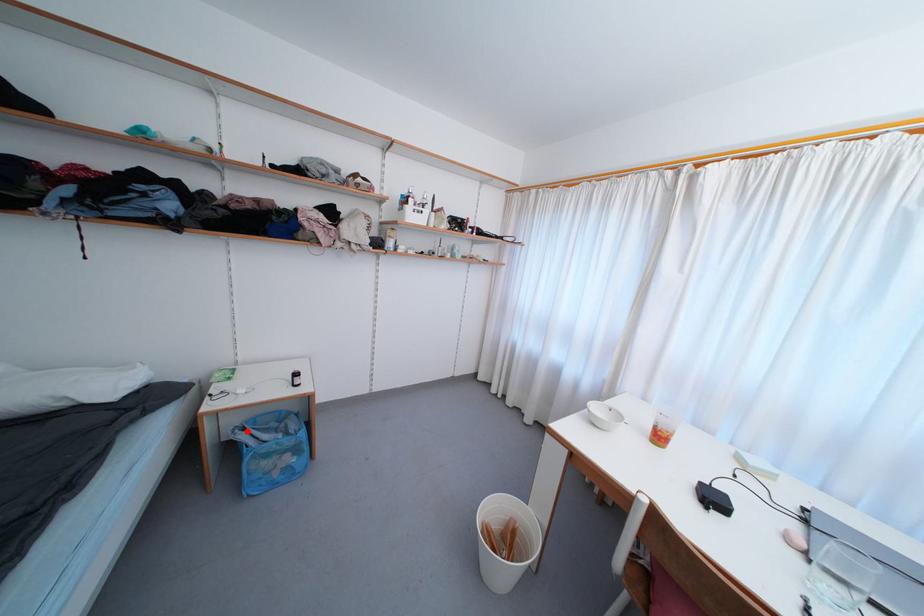
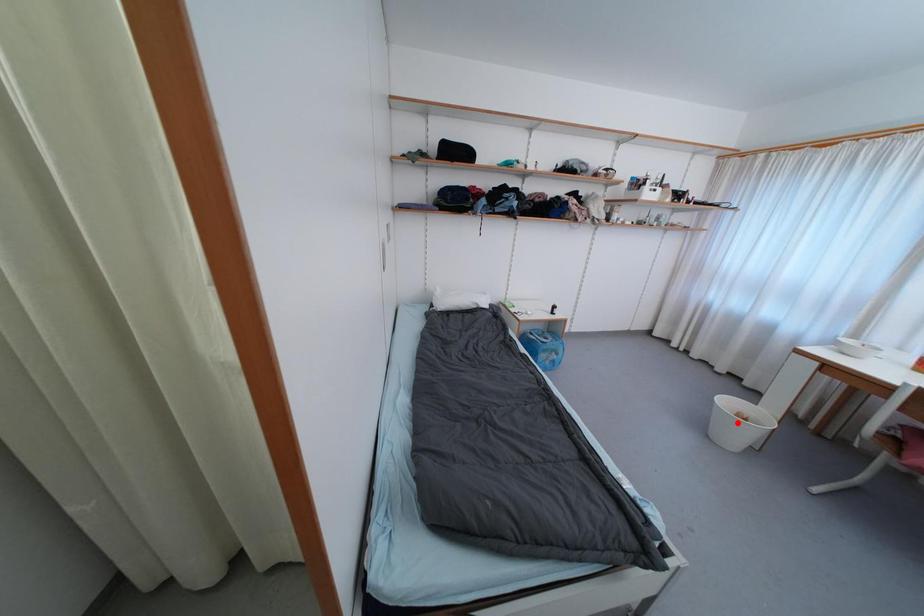
I am providing you with two images of the same scene from different viewpoints. A red point is marked on the first image and another point is marked on the second image. Are the points marked in image1 and image2 representing the same 3D position?

No